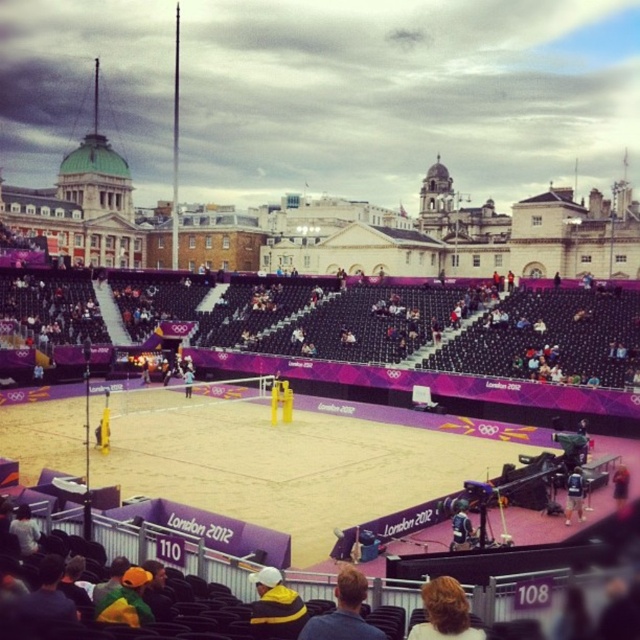
Question: Where is light brown leather jacket at lower right located in relation to yellow fabric person at center in the image?

Choices:
 (A) right
 (B) left

Answer: (A)

Question: Which object is closer to the camera taking this photo?

Choices:
 (A) dark blue jacket at center
 (B) denim jacket at lower center
 (C) sand at center

Answer: (B)

Question: Can you confirm if blue backpack at lower right is wider than yellow fabric person at center?

Choices:
 (A) no
 (B) yes

Answer: (A)

Question: From the image, what is the correct spatial relationship of yellow and black jacket at lower center in relation to light brown leather jacket at lower right?

Choices:
 (A) above
 (B) below

Answer: (B)

Question: Among these objects, which one is nearest to the camera?

Choices:
 (A) yellow and black jacket at lower center
 (B) velvet yellow jacket at lower left

Answer: (B)

Question: Based on their relative distances, which object is farther from the blonde hair at lower center?

Choices:
 (A) yellow and black jacket at lower center
 (B) velvet yellow jacket at lower left
 (C) light brown leather jacket at lower right

Answer: (C)